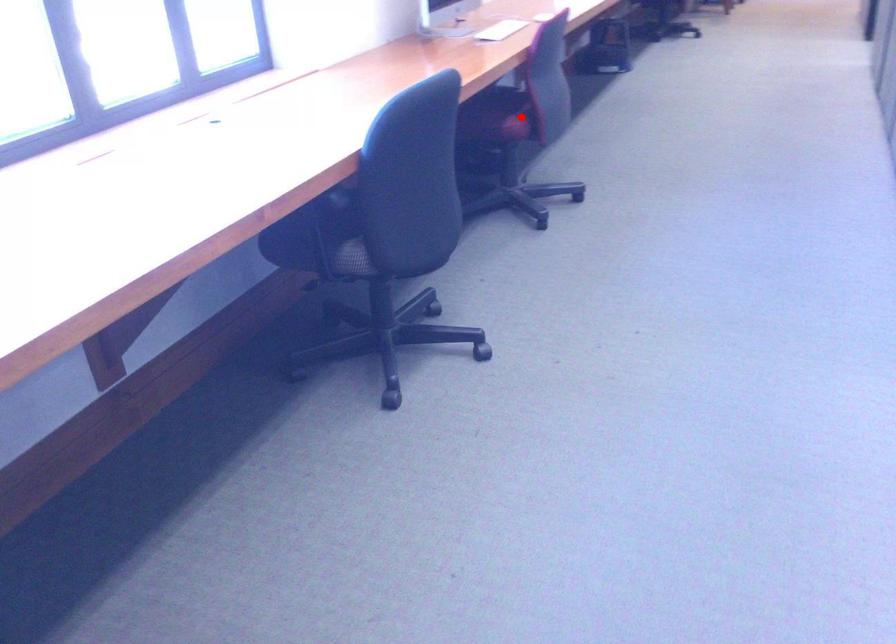
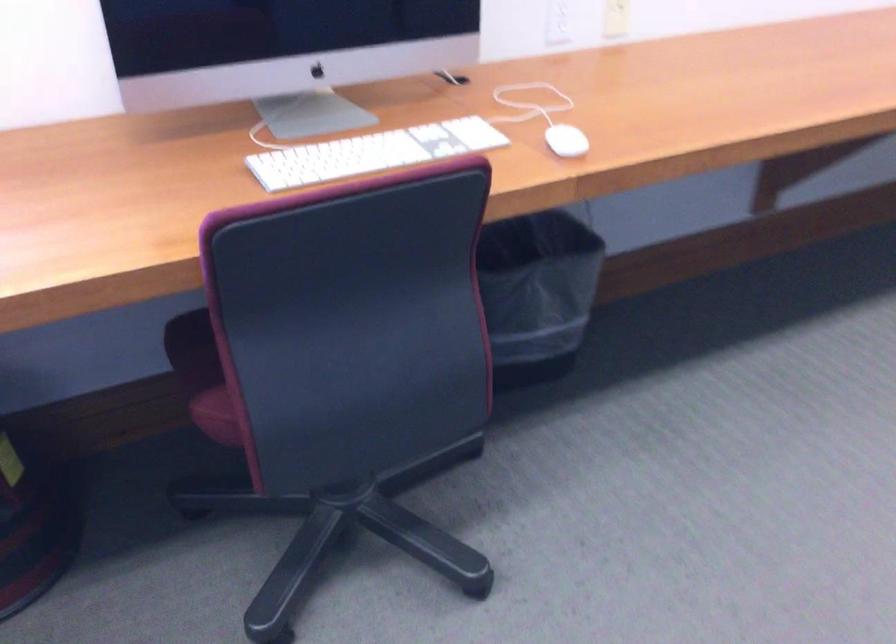
Where in the second image is the point corresponding to the highlighted location from the first image?

(220, 413)